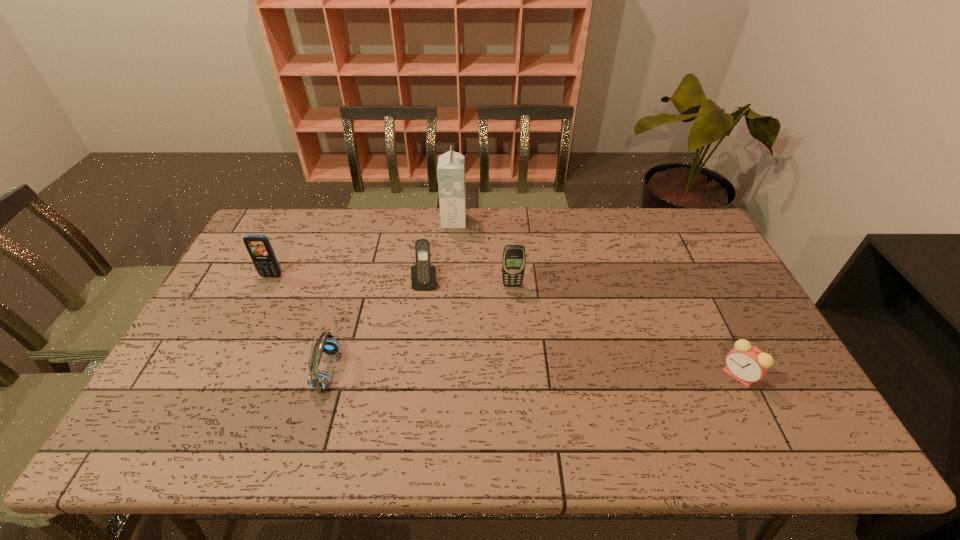
This screenshot has height=540, width=960. What are the coordinates of `vacant space located on the front-facing side of the second cellular telephone from right to left` in the screenshot? It's located at (422, 306).

Identify the location of blank space located 0.360m on the face of the alarm clock. (582, 375).

Locate an element on the screen. vacant space located on the face of the alarm clock is located at coordinates (675, 375).

Where is `vacant space located on the face of the alarm clock`? The image size is (960, 540). vacant space located on the face of the alarm clock is located at coordinates (691, 375).

This screenshot has height=540, width=960. I want to click on vacant space situated 0.060m on the ear cups of the fifth object from right to left, so click(x=360, y=369).

Where is `object that is at the far edge`? object that is at the far edge is located at coordinates (451, 165).

You are a GUI agent. You are given a task and a screenshot of the screen. Output one action in this format:
    pyautogui.click(x=<x>, y=<y>)
    Task: Click on the object that is at the left edge
    
    Given the screenshot: What is the action you would take?
    pyautogui.click(x=259, y=248)

The width and height of the screenshot is (960, 540). Find the location of `object at the right edge`. object at the right edge is located at coordinates (747, 364).

Locate an element on the screen. This screenshot has height=540, width=960. vacant space at the far edge is located at coordinates (620, 243).

This screenshot has height=540, width=960. In the image, there is a desktop. In order to click on vacant space at the near edge in this screenshot , I will do `click(574, 445)`.